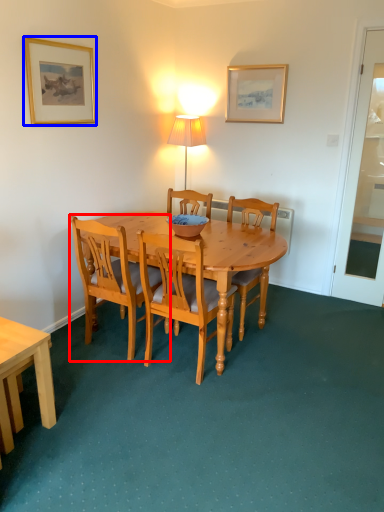
Question: Which object appears farthest to the camera in this image, chair (highlighted by a red box) or picture frame (highlighted by a blue box)?

Choices:
 (A) chair
 (B) picture frame

Answer: (B)